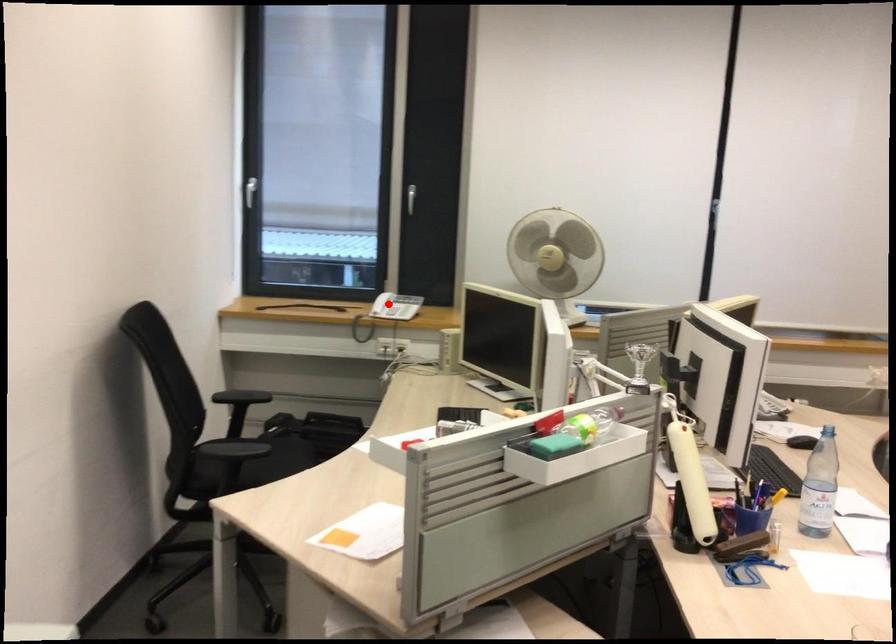
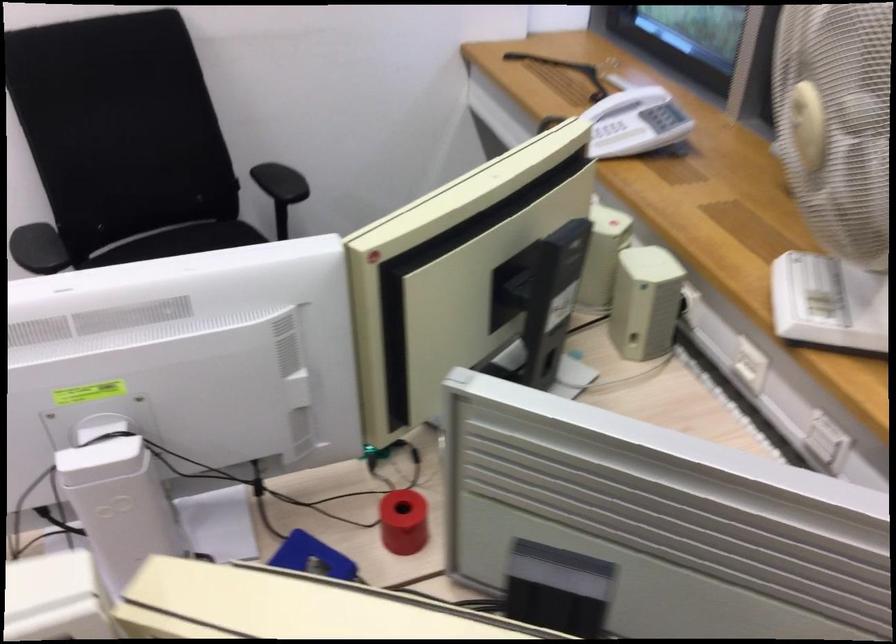
Question: A red point is marked in image1. In image2, is the corresponding 3D point closer to the camera or farther? Reply with the corresponding letter.

Choices:
 (A) The corresponding 3D point is closer.
 (B) The corresponding 3D point is farther.

Answer: (A)